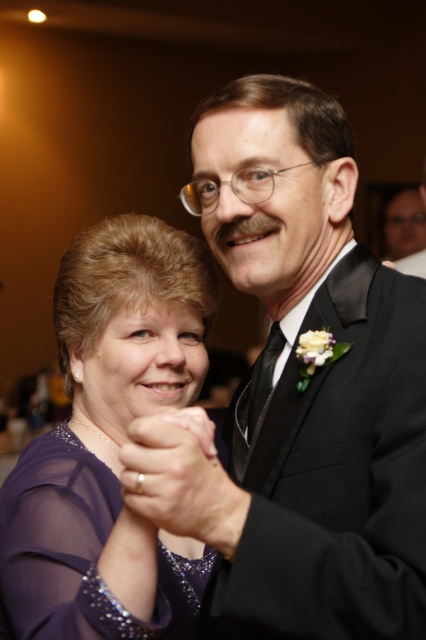
Question: Is purple sheer dress at lower left behind purple sheer dress at center?

Choices:
 (A) no
 (B) yes

Answer: (A)

Question: Which point appears farthest from the camera in this image?

Choices:
 (A) (40, 602)
 (B) (141, 522)

Answer: (A)

Question: Is purple sheer dress at lower left to the right of purple sheer dress at center from the viewer's perspective?

Choices:
 (A) yes
 (B) no

Answer: (A)

Question: Can you confirm if purple sheer dress at lower left is positioned to the right of purple sheer dress at center?

Choices:
 (A) no
 (B) yes

Answer: (B)